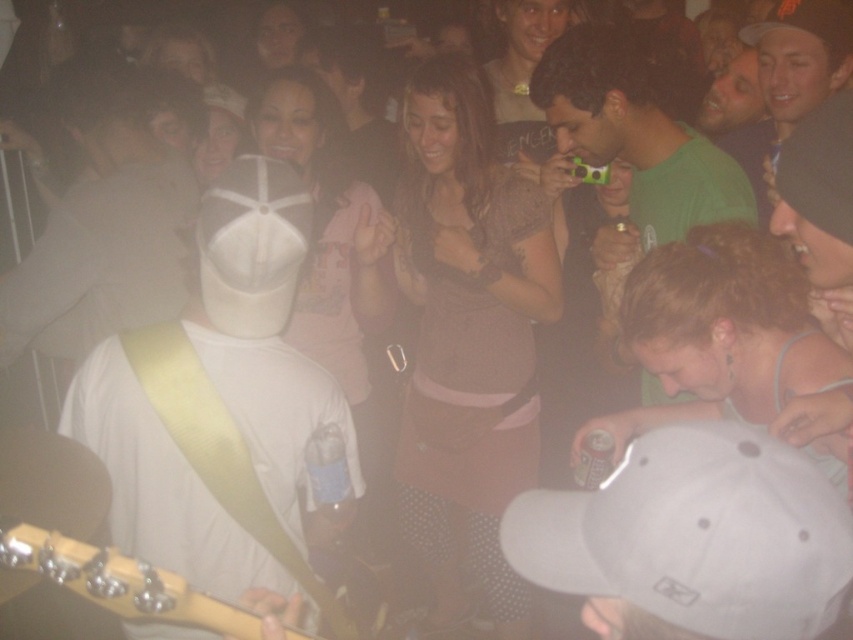
You are a photographer at the concert wanting to capture a photo of the white matte baseball cap at center and the wooden acoustic guitar at left. Which object should you focus on first if you want to ensure both are in focus without adjusting the camera settings?

The white matte baseball cap at center is further to the viewer than the wooden acoustic guitar at left. To keep both in focus, you should focus on the wooden acoustic guitar at left first, as it is closer and adjusting focus from close to far ensures the cap remains in focus as well.

You are a photographer at the concert. You want to take a closeup shot of the white matte baseball cap at center. What are the coordinates to focus on?

The coordinates to focus on are at point [252,244].